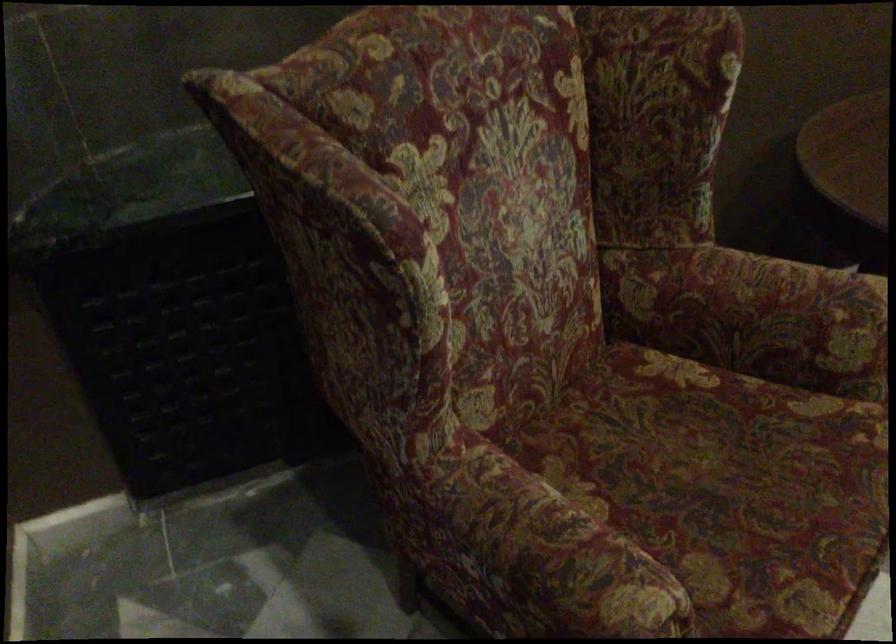
At what (x,y) coordinates should I click in order to perform the action: click on patterned chair surface. Please return your answer as a coordinate pair (x, y). Looking at the image, I should click on (726, 486).